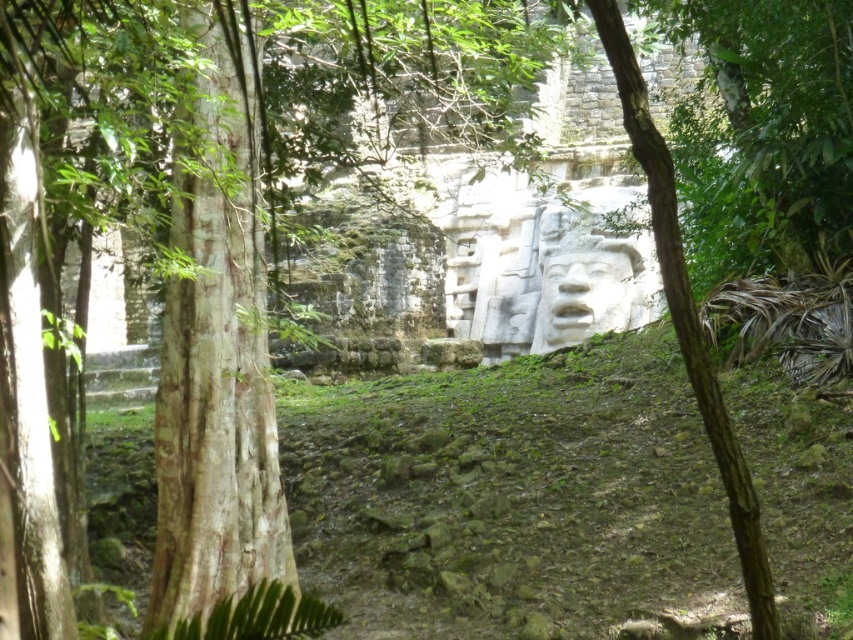
Question: Is white stone carving at center above white stone face at center?

Choices:
 (A) no
 (B) yes

Answer: (B)

Question: Can you confirm if white stone carving at center is positioned to the left of white stone face at center?

Choices:
 (A) yes
 (B) no

Answer: (B)

Question: Is white stone carving at center smaller than white stone face at center?

Choices:
 (A) yes
 (B) no

Answer: (B)

Question: Which point is closer to the camera taking this photo?

Choices:
 (A) (630, 278)
 (B) (608, 298)

Answer: (B)

Question: Among these objects, which one is nearest to the camera?

Choices:
 (A) white stone face at center
 (B) white stone carving at center

Answer: (A)

Question: Which point is farther from the camera taking this photo?

Choices:
 (A) (611, 316)
 (B) (561, 266)

Answer: (B)